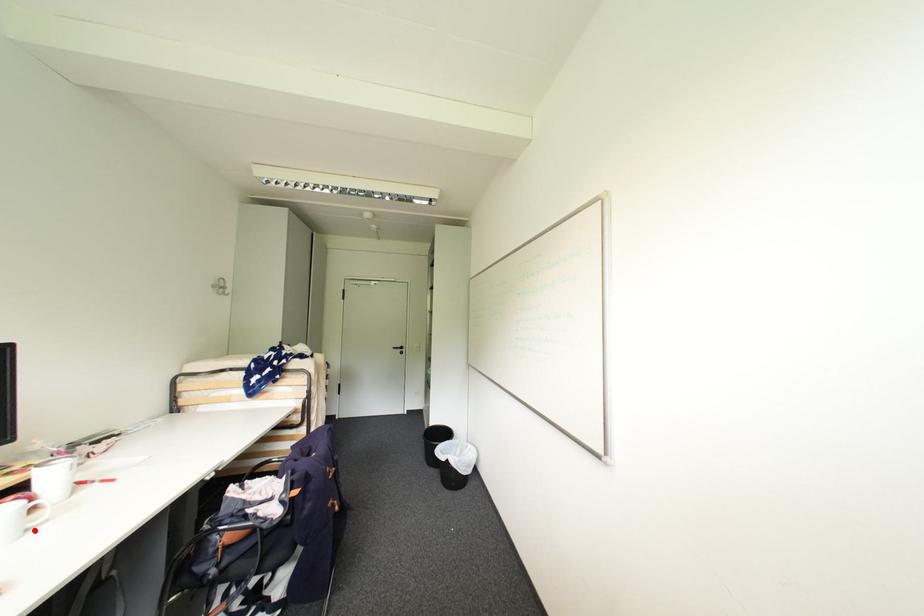
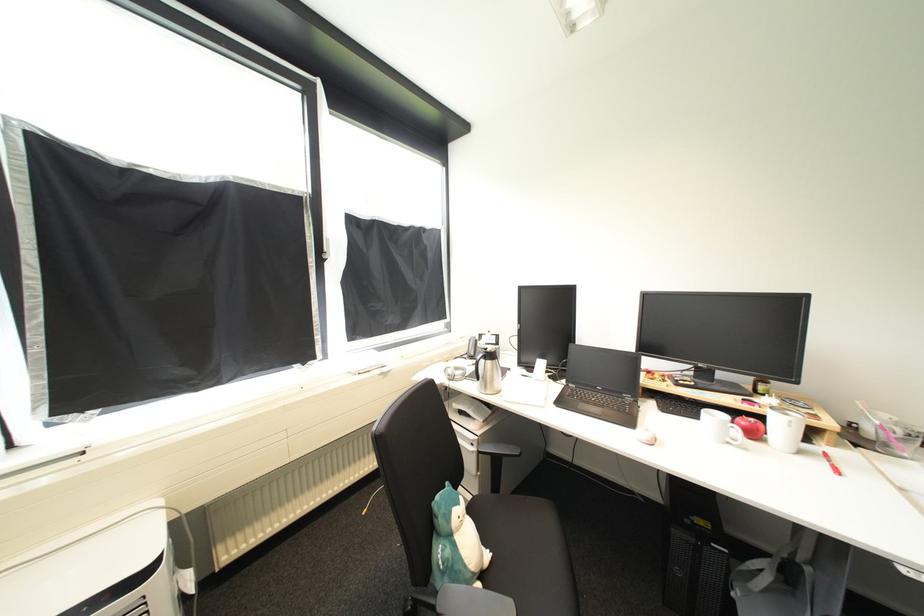
Find the pixel in the second image that matches the highlighted location in the first image.

(736, 445)